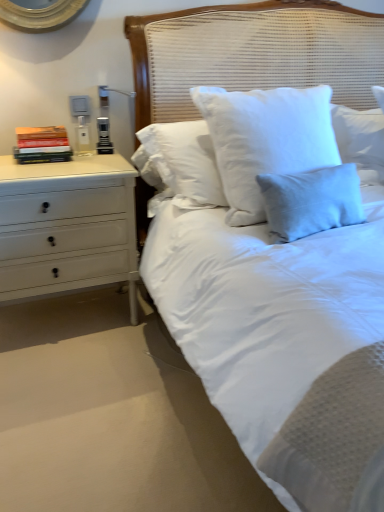
Identify the location of white painted wood chest of drawers at left. This screenshot has width=384, height=512. (67, 227).

In order to face hardcover books at left, should I rotate leftwards or rightwards?

It's best to rotate left around 19.111 degrees.

This screenshot has width=384, height=512. In order to click on white woven headboard at center in this screenshot , I will do `click(252, 53)`.

Locate an element on the screen. white painted wood chest of drawers at left is located at coordinates (67, 227).

From a real-world perspective, is white painted wood chest of drawers at left above or below hardcover books at left?

In terms of real-world spatial position, white painted wood chest of drawers at left is below hardcover books at left.

Is white painted wood chest of drawers at left next to hardcover books at left and touching it?

No, white painted wood chest of drawers at left is not making contact with hardcover books at left.

In the scene shown: Is white painted wood chest of drawers at left inside the boundaries of hardcover books at left, or outside?

The correct answer is: outside.

Does white painted wood chest of drawers at left have a smaller size compared to hardcover books at left?

Incorrect, white painted wood chest of drawers at left is not smaller in size than hardcover books at left.

From the picture: Considering the sizes of objects hardcover books at left and white woven headboard at center in the image provided, who is smaller, hardcover books at left or white woven headboard at center?

hardcover books at left.

Is hardcover books at left shorter than white woven headboard at center?

Correct, hardcover books at left is not as tall as white woven headboard at center.

Does hardcover books at left have a lesser width compared to white woven headboard at center?

Correct, the width of hardcover books at left is less than that of white woven headboard at center.

Does hardcover books at left come behind white painted wood chest of drawers at left?

Yes.

Does point (47, 131) lie behind point (31, 213)?

That is True.

Is hardcover books at left beside white painted wood chest of drawers at left?

No, hardcover books at left is not in contact with white painted wood chest of drawers at left.

From a real-world perspective, which object stands above the other?

From a 3D spatial view, hardcover books at left is above.

Consider the image. Can hardcover books at left be found inside white woven headboard at center?

No, hardcover books at left is not a part of white woven headboard at center.

Is point (166, 113) positioned after point (19, 141)?

Yes.

From the image's perspective, is white woven headboard at center over hardcover books at left?

No.

Is white woven headboard at center smaller than hardcover books at left?

No, white woven headboard at center is not smaller than hardcover books at left.

Is white painted wood chest of drawers at left situated inside white woven headboard at center or outside?

white painted wood chest of drawers at left is outside white woven headboard at center.

Is white painted wood chest of drawers at left turned away from white woven headboard at center?

That's not correct — white painted wood chest of drawers at left is not looking away from white woven headboard at center.

In the scene shown: Which object is further away from the camera taking this photo, white painted wood chest of drawers at left or white woven headboard at center?

white painted wood chest of drawers at left is further from the camera.

Is white woven headboard at center taller than white painted wood chest of drawers at left?

Correct, white woven headboard at center is much taller as white painted wood chest of drawers at left.

Does white woven headboard at center touch white painted wood chest of drawers at left?

white woven headboard at center is not next to white painted wood chest of drawers at left, and they're not touching.

Which is nearer, (369, 75) or (61, 236)?

Point (369, 75) is positioned farther from the camera compared to point (61, 236).

The width and height of the screenshot is (384, 512). Find the location of `the chest of drawers in front of the hardcover books at left`. the chest of drawers in front of the hardcover books at left is located at coordinates (67, 227).

Locate an element on the screen. The height and width of the screenshot is (512, 384). book on the left of white woven headboard at center is located at coordinates (42, 145).

Considering their positions, is hardcover books at left positioned further to white painted wood chest of drawers at left than white woven headboard at center?

white woven headboard at center is positioned further to the anchor white painted wood chest of drawers at left.

From the image, which object appears to be farther from white painted wood chest of drawers at left, white woven headboard at center or hardcover books at left?

Among the two, white woven headboard at center is located further to white painted wood chest of drawers at left.

Based on their spatial positions, is hardcover books at left or white painted wood chest of drawers at left further from white woven headboard at center?

The object further to white woven headboard at center is hardcover books at left.

Estimate the real-world distances between objects in this image. Which object is closer to hardcover books at left, white woven headboard at center or white painted wood chest of drawers at left?

white painted wood chest of drawers at left lies closer to hardcover books at left than the other object.

Consider the image. From the image, which object appears to be nearer to hardcover books at left, white painted wood chest of drawers at left or white woven headboard at center?

The object closer to hardcover books at left is white painted wood chest of drawers at left.

When comparing their distances from white woven headboard at center, does white painted wood chest of drawers at left or hardcover books at left seem closer?

white painted wood chest of drawers at left is positioned closer to the anchor white woven headboard at center.

The height and width of the screenshot is (512, 384). In order to click on the chest of drawers situated between hardcover books at left and white woven headboard at center from left to right in this screenshot , I will do `click(67, 227)`.